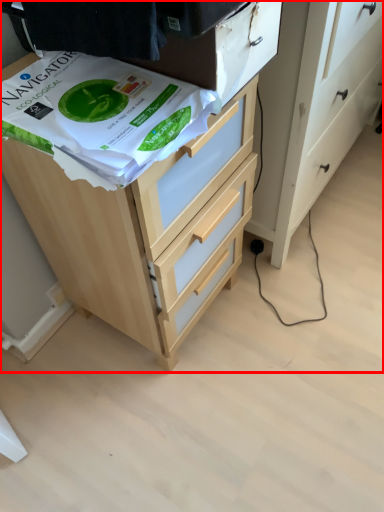
Question: Where is chest of drawers (annotated by the red box) located in relation to wrapping paper in the image?

Choices:
 (A) right
 (B) left

Answer: (A)